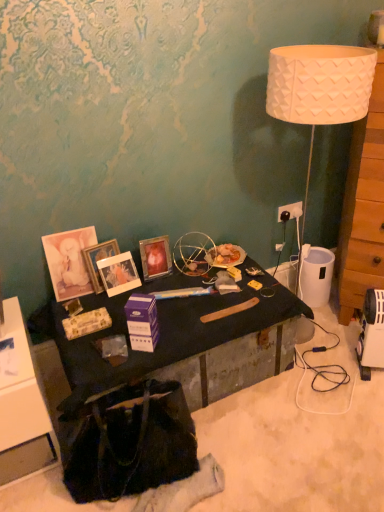
Where is `vacant space to the right of purple cardboard box at center`? Image resolution: width=384 pixels, height=512 pixels. vacant space to the right of purple cardboard box at center is located at coordinates (185, 332).